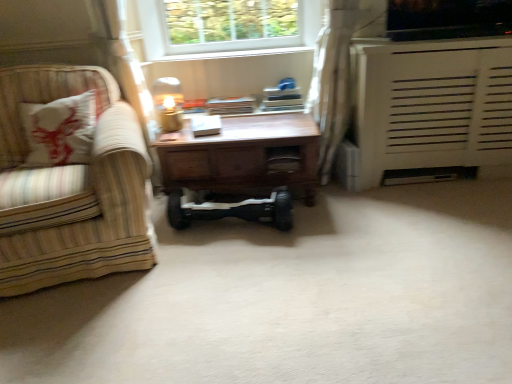
You are a GUI agent. You are given a task and a screenshot of the screen. Output one action in this format:
    pyautogui.click(x=<x>, y=<y>)
    Task: Click on the vacant space to the right of matte gold table lamp at center
    The image size is (512, 384).
    Given the screenshot: What is the action you would take?
    pyautogui.click(x=194, y=123)